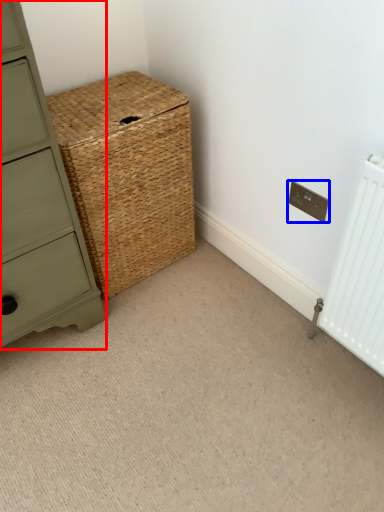
Question: Which object is closer to the camera taking this photo, chest of drawers (highlighted by a red box) or electric outlet (highlighted by a blue box)?

Choices:
 (A) chest of drawers
 (B) electric outlet

Answer: (A)